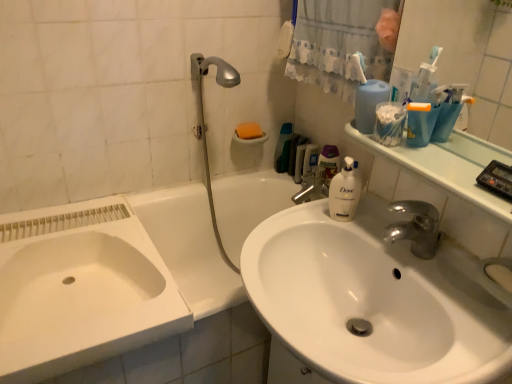
Locate an element on the screen. vacant area that is situated to the right of white plastic cotton swabs at upper right, which is the 1th mouthwash in front-to-back order is located at coordinates (445, 157).